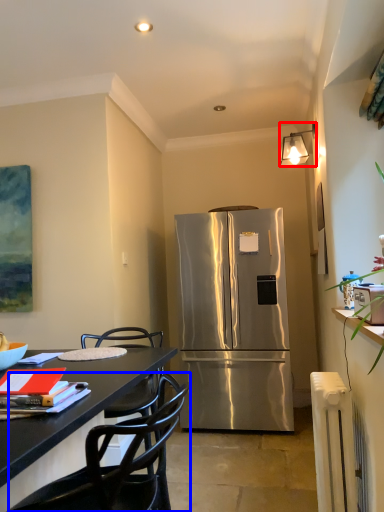
Question: Which object appears farthest to the camera in this image, lamp (highlighted by a red box) or chair (highlighted by a blue box)?

Choices:
 (A) lamp
 (B) chair

Answer: (A)